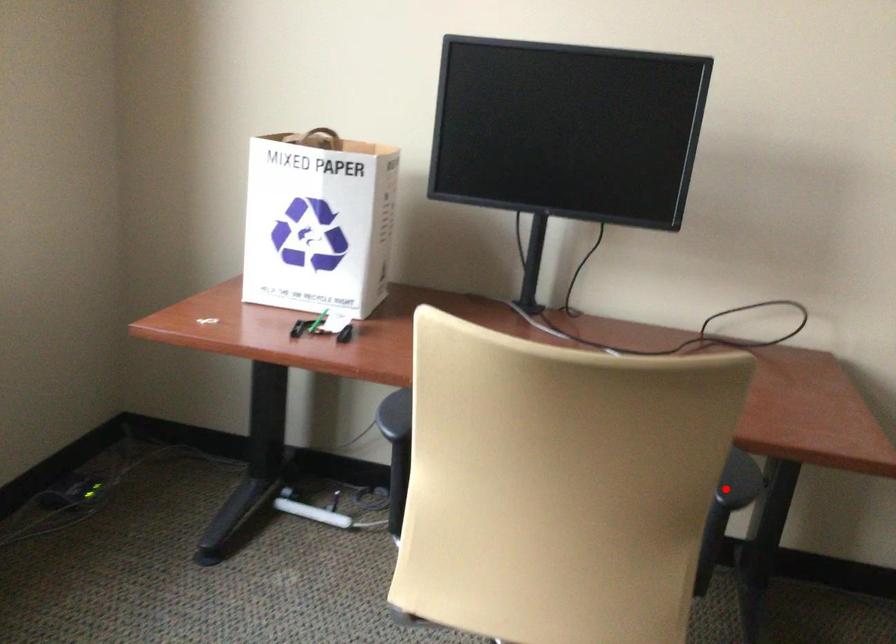
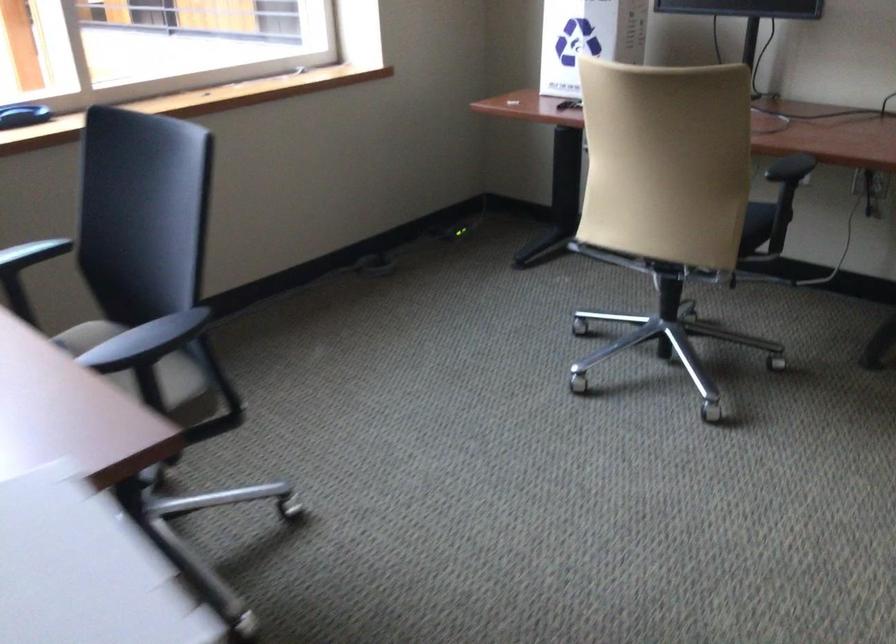
Question: A red point is marked in image1. In image2, is the corresponding 3D point closer to the camera or farther? Reply with the corresponding letter.

Choices:
 (A) The corresponding 3D point is closer.
 (B) The corresponding 3D point is farther.

Answer: (B)